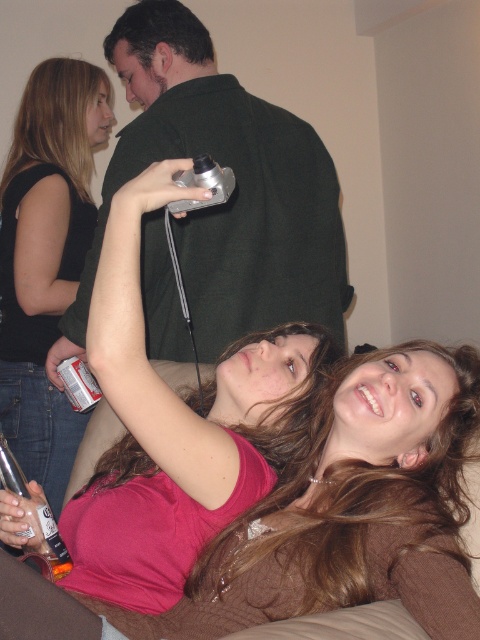
Is point (195, 316) positioned behind point (36, 518)?

Yes, point (195, 316) is farther from viewer.

Is green matte shirt at upper center positioned in front of translucent plastic bottle at lower left?

No, green matte shirt at upper center is further to the viewer.

Measure the distance between green matte shirt at upper center and camera.

5.13 feet

Locate an element on the screen. The image size is (480, 640). green matte shirt at upper center is located at coordinates (x=232, y=193).

Does matte black camera at upper left have a lesser width compared to silver metallic game controller at upper center?

No, matte black camera at upper left is not thinner than silver metallic game controller at upper center.

How far apart are matte black camera at upper left and silver metallic game controller at upper center?

matte black camera at upper left and silver metallic game controller at upper center are 31.49 inches apart from each other.

Locate an element on the screen. Image resolution: width=480 pixels, height=640 pixels. matte black camera at upper left is located at coordinates (46, 257).

I want to click on matte black camera at upper left, so click(x=46, y=257).

Between point (444, 524) and point (201, 179), which one is positioned in front?

Positioned in front is point (444, 524).

Which is behind, point (441, 524) or point (194, 166)?

The point (194, 166) is more distant.

Measure the distance between point (359, 493) and camera.

The distance of point (359, 493) from camera is 3.41 feet.

The image size is (480, 640). In order to click on pink matte shirt at center in this screenshot , I will do `click(351, 512)`.